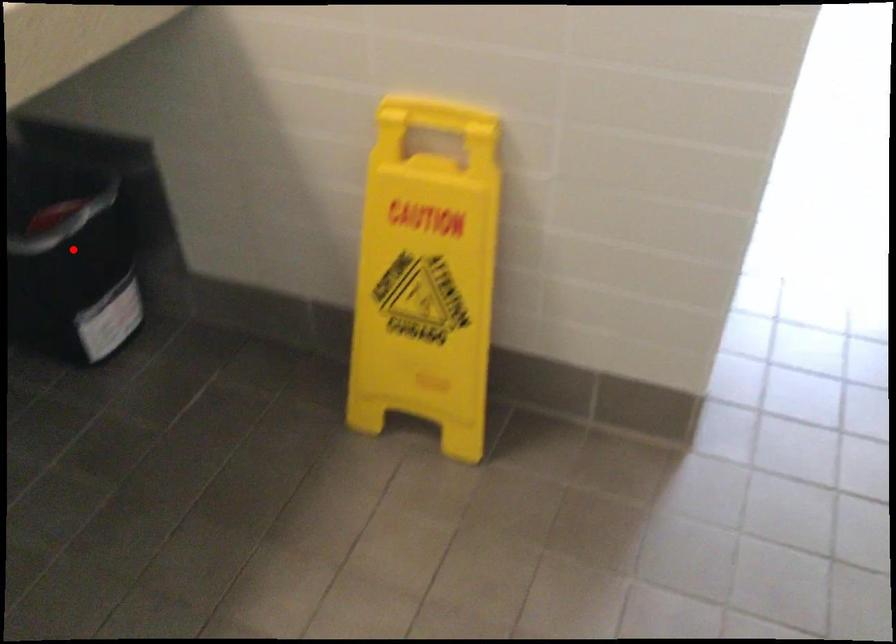
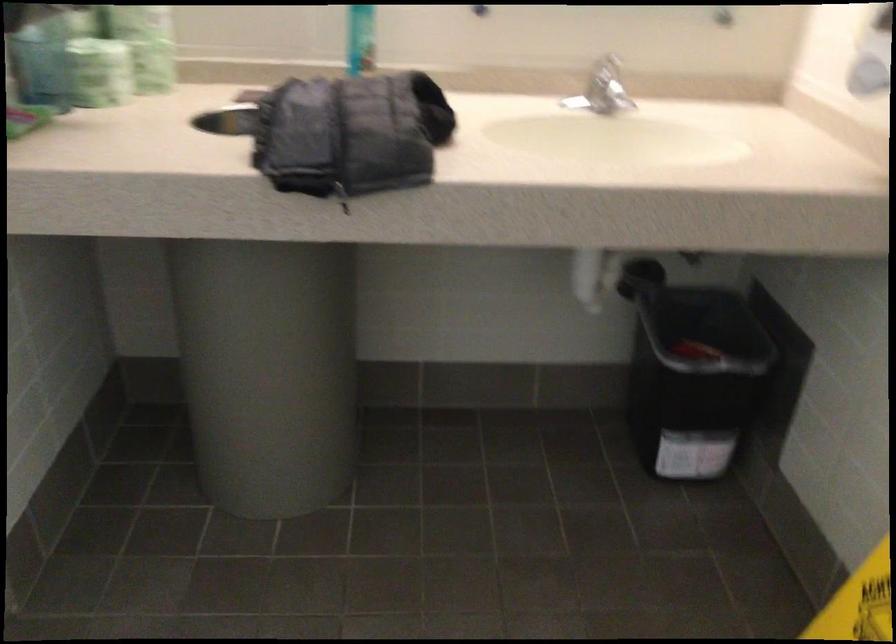
Question: I am providing you with two images of the same scene from different viewpoints. A red point is shown in image1. For the corresponding object point in image2, is it positioned nearer or farther from the camera?

Choices:
 (A) Nearer
 (B) Farther

Answer: (B)